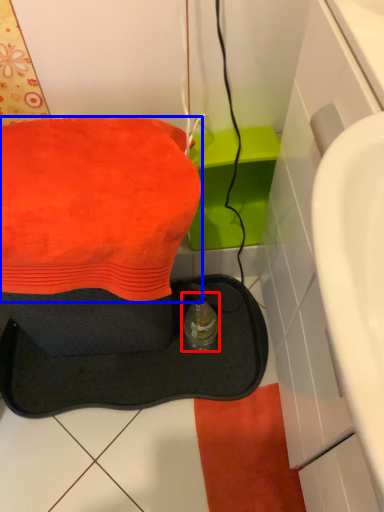
Question: Which object appears closest to the camera in this image, bottle (highlighted by a red box) or towel (highlighted by a blue box)?

Choices:
 (A) bottle
 (B) towel

Answer: (B)